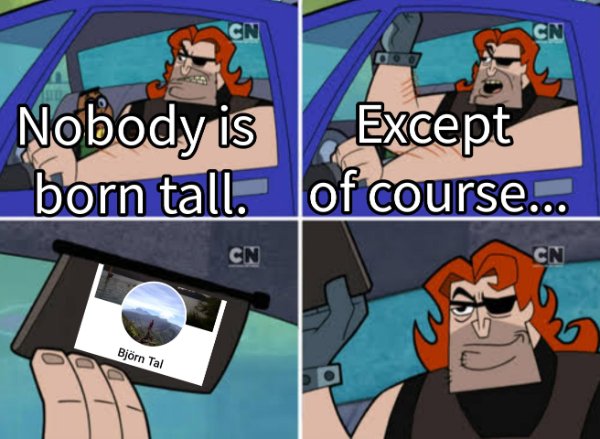
In order to click on handle in this screenshot , I will do `click(253, 186)`, `click(557, 187)`.